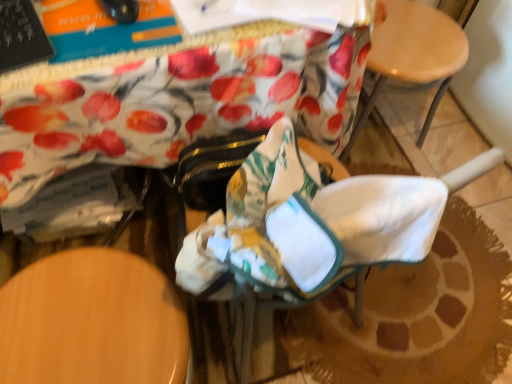
Question: Does white fabric rocking chair at center have a lesser width compared to wooden at upper right?

Choices:
 (A) no
 (B) yes

Answer: (A)

Question: Is white fabric rocking chair at center completely or partially outside of wooden at upper right?

Choices:
 (A) no
 (B) yes

Answer: (B)

Question: Considering the relative positions of white fabric rocking chair at center and wooden at upper right in the image provided, is white fabric rocking chair at center to the right of wooden at upper right from the viewer's perspective?

Choices:
 (A) yes
 (B) no

Answer: (B)

Question: Is white fabric rocking chair at center positioned with its back to wooden at upper right?

Choices:
 (A) no
 (B) yes

Answer: (A)

Question: Is white fabric rocking chair at center far from wooden at upper right?

Choices:
 (A) yes
 (B) no

Answer: (B)

Question: From a real-world perspective, is white fabric rocking chair at center on top of wooden at upper right?

Choices:
 (A) yes
 (B) no

Answer: (A)

Question: Can you confirm if wooden at upper right is shorter than white fabric rocking chair at center?

Choices:
 (A) yes
 (B) no

Answer: (A)

Question: From the image's perspective, is wooden at upper right beneath white fabric rocking chair at center?

Choices:
 (A) no
 (B) yes

Answer: (A)

Question: From a real-world perspective, is wooden at upper right beneath white fabric rocking chair at center?

Choices:
 (A) no
 (B) yes

Answer: (B)

Question: Can you confirm if wooden at upper right is positioned to the left of white fabric rocking chair at center?

Choices:
 (A) no
 (B) yes

Answer: (A)

Question: Is wooden at upper right not inside white fabric rocking chair at center?

Choices:
 (A) yes
 (B) no

Answer: (A)

Question: From a real-world perspective, is wooden at upper right on white fabric rocking chair at center?

Choices:
 (A) yes
 (B) no

Answer: (B)

Question: Is white fabric rocking chair at center to the left or to the right of wooden at upper right in the image?

Choices:
 (A) left
 (B) right

Answer: (A)